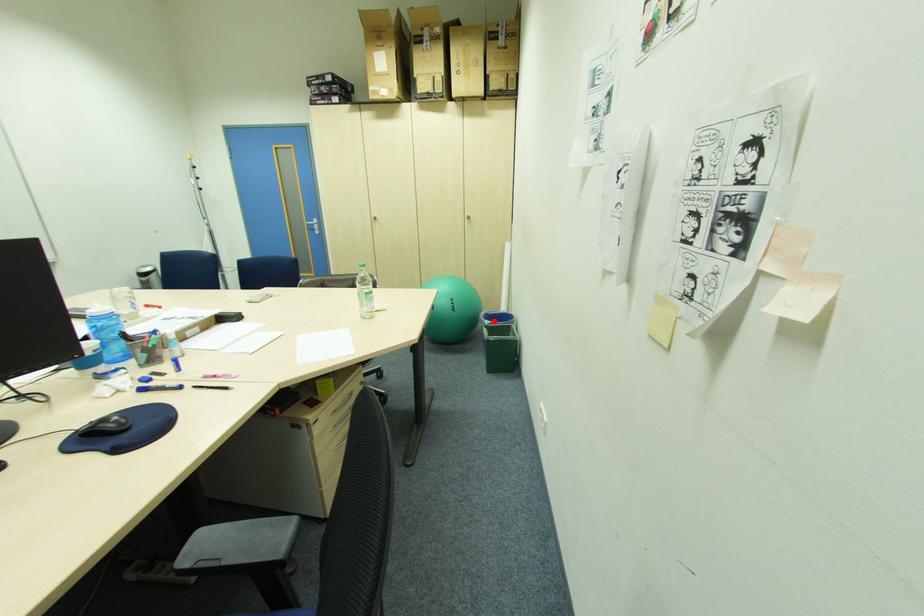
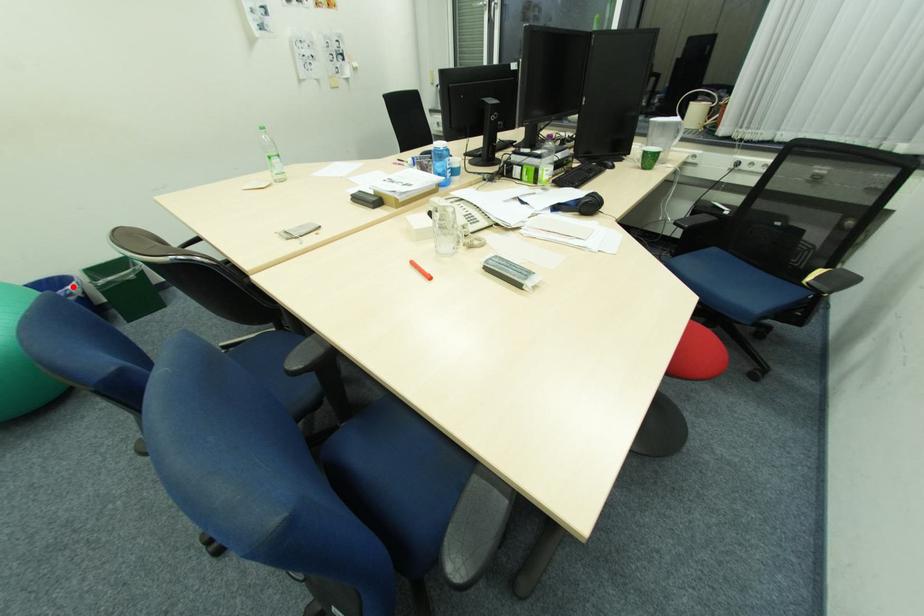
I am providing you with two images of the same scene from different viewpoints. A red point is marked on the first image and another point is marked on the second image. Do the highlighted points in image1 and image2 indicate the same real-world spot?

Yes